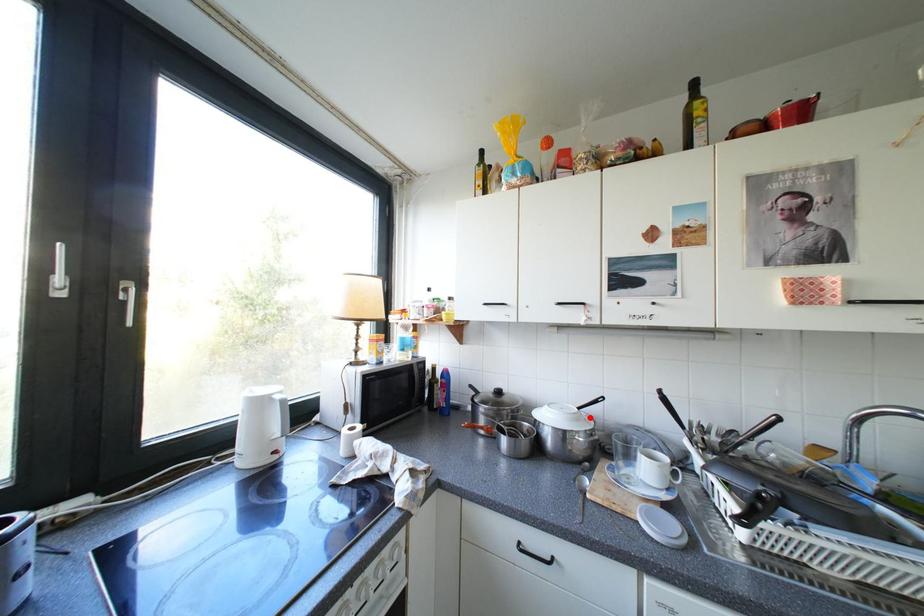
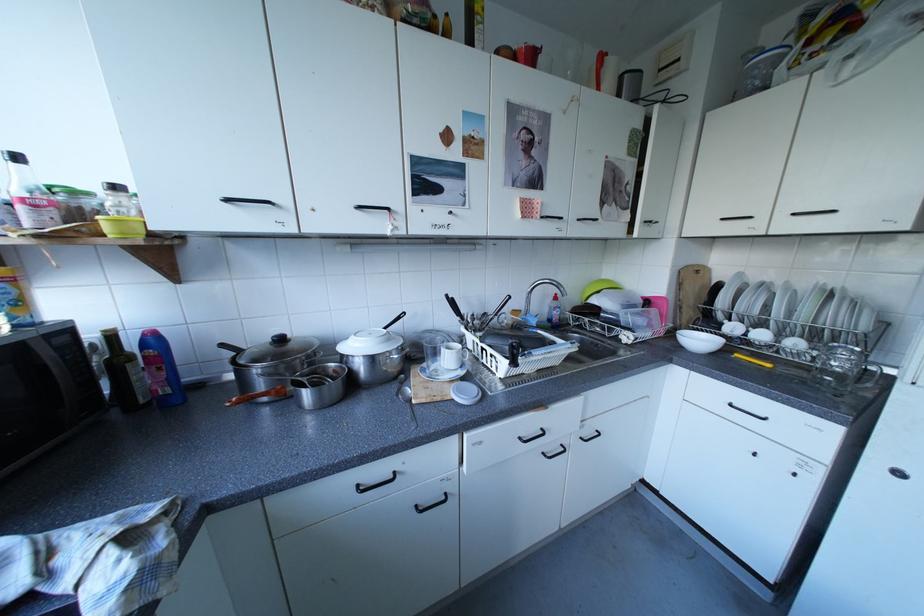
Where in the second image is the point corresponding to the highlighted location from the first image?

(400, 338)